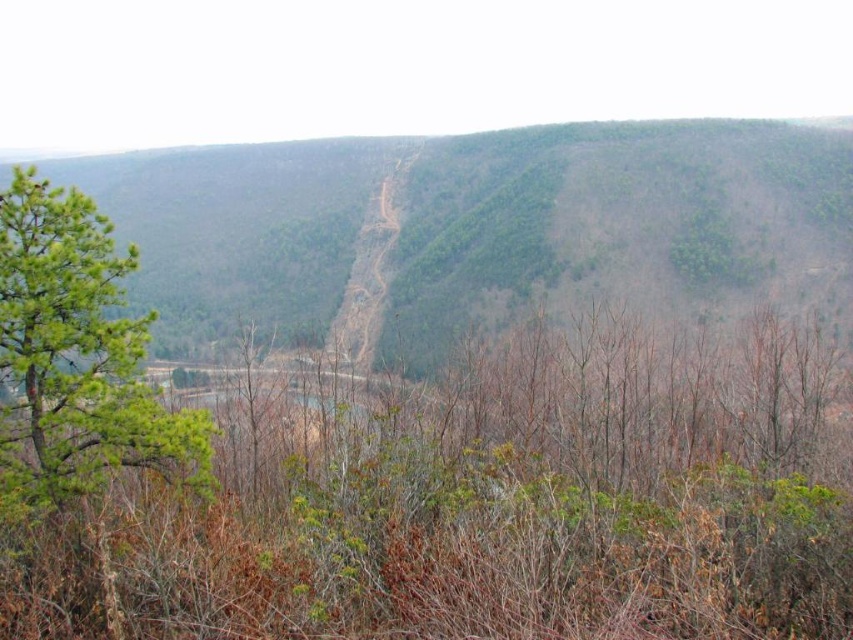
Who is higher up, green leafy hillside at center or brown dirt path at center?

green leafy hillside at center is above.

Can you confirm if green leafy hillside at center is positioned above brown dirt path at center?

Indeed, green leafy hillside at center is positioned over brown dirt path at center.

Does point (323, 166) lie behind point (386, 288)?

That is True.

At what (x,y) coordinates should I click in order to perform the action: click on green leafy hillside at center. Please return your answer as a coordinate pair (x, y). Image resolution: width=853 pixels, height=640 pixels. Looking at the image, I should click on (476, 228).

Does green needle-like tree at left have a larger size compared to brown dirt path at center?

No.

Who is more forward, (54,467) or (335,321)?

Point (54,467) is in front.

Which is behind, point (45, 232) or point (422, 144)?

The point (422, 144) is more distant.

Locate an element on the screen. green needle-like tree at left is located at coordinates (76, 358).

Is point (614, 180) positioned in front of point (7, 346)?

No, (614, 180) is behind (7, 346).

Find the location of a particular element. This screenshot has height=640, width=853. green leafy hillside at center is located at coordinates (476, 228).

Does point (256, 204) come closer to viewer compared to point (123, 424)?

No, (256, 204) is further to viewer.

At what (x,y) coordinates should I click in order to perform the action: click on green leafy hillside at center. Please return your answer as a coordinate pair (x, y). Looking at the image, I should click on coord(476,228).